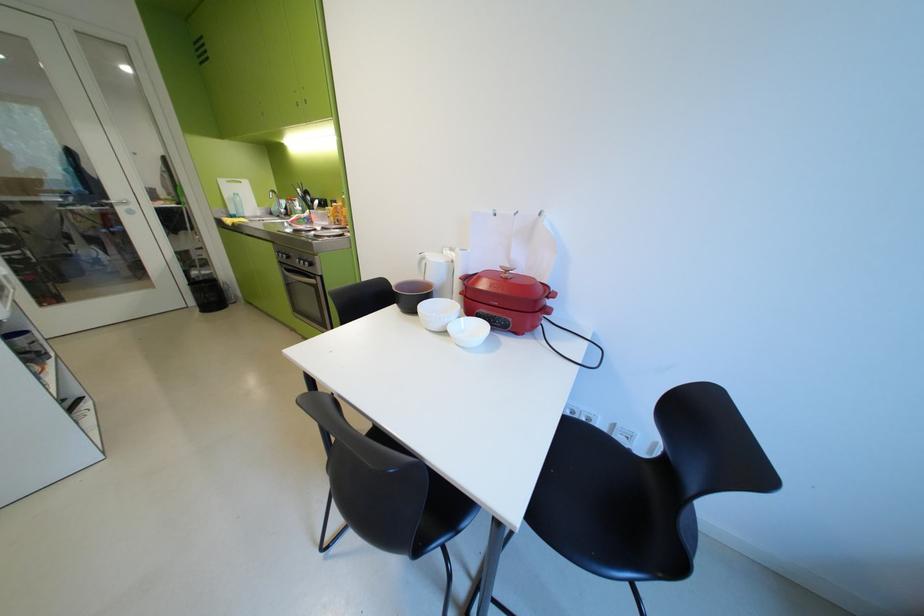
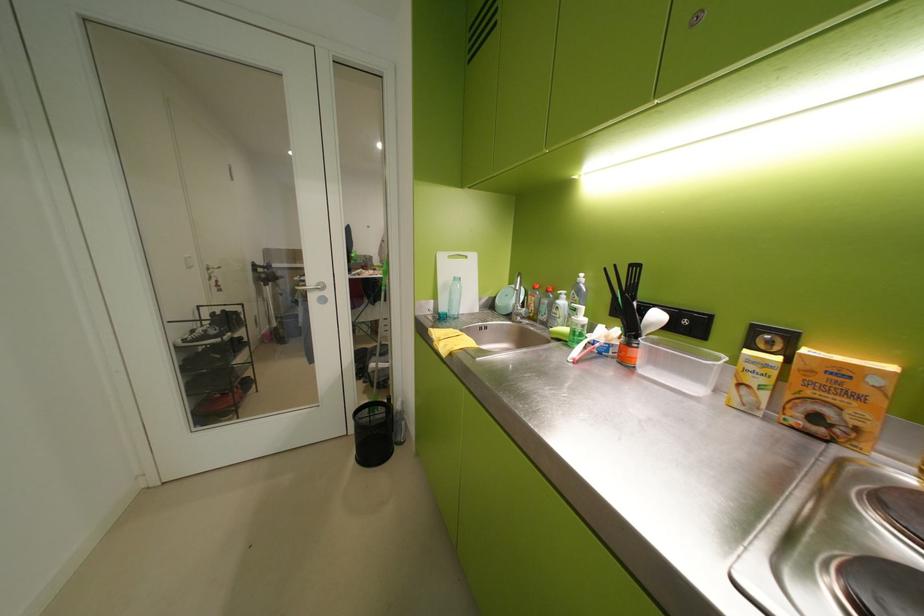
The point at (327, 203) is marked in the first image. Where is the corresponding point in the second image?

(667, 317)